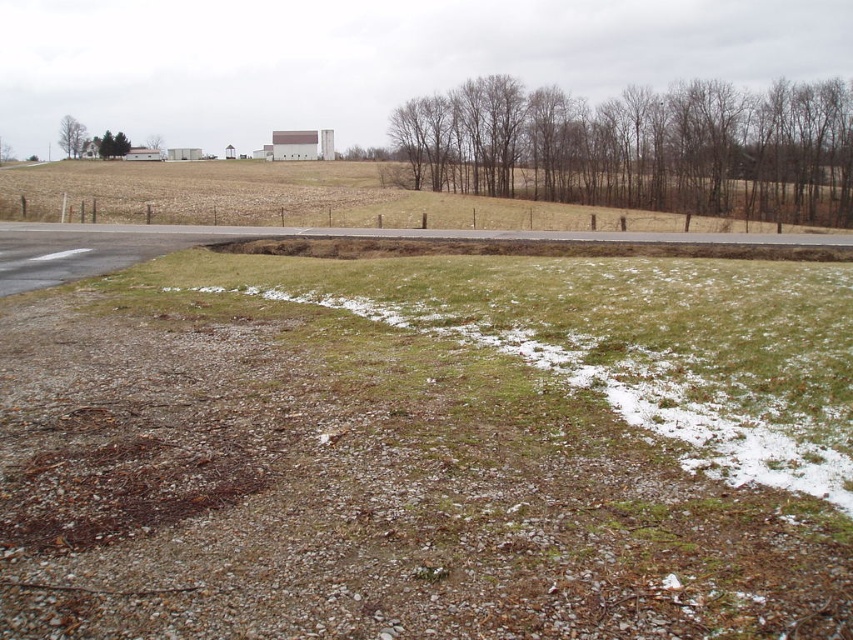
Question: Based on their relative distances, which object is farther from the green leafy tree at upper left?

Choices:
 (A) green grassy field at upper center
 (B) bare wood trees at upper right

Answer: (B)

Question: Where is bare wood trees at upper right located in relation to green leafy tree at upper left in the image?

Choices:
 (A) left
 (B) right

Answer: (B)

Question: Does bare wood trees at upper right appear on the left side of green grassy field at upper center?

Choices:
 (A) yes
 (B) no

Answer: (B)

Question: Considering the real-world distances, which object is closest to the green grassy field at upper center?

Choices:
 (A) green leafy tree at upper left
 (B) bare wood trees at upper right

Answer: (B)

Question: Which object is positioned farthest from the green grassy field at upper center?

Choices:
 (A) green leafy tree at upper left
 (B) bare wood trees at upper right

Answer: (A)

Question: Can you confirm if bare wood trees at upper right is positioned to the right of green leafy tree at upper left?

Choices:
 (A) yes
 (B) no

Answer: (A)